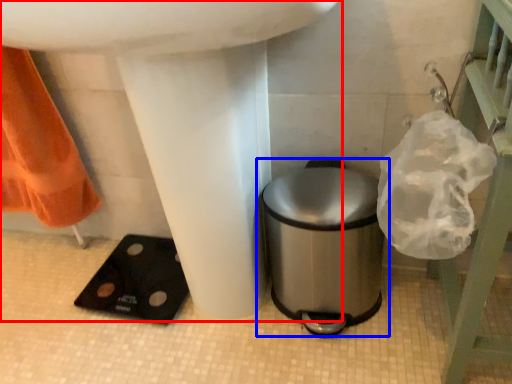
Question: Which object is further to the camera taking this photo, sink (highlighted by a red box) or waste container (highlighted by a blue box)?

Choices:
 (A) sink
 (B) waste container

Answer: (B)